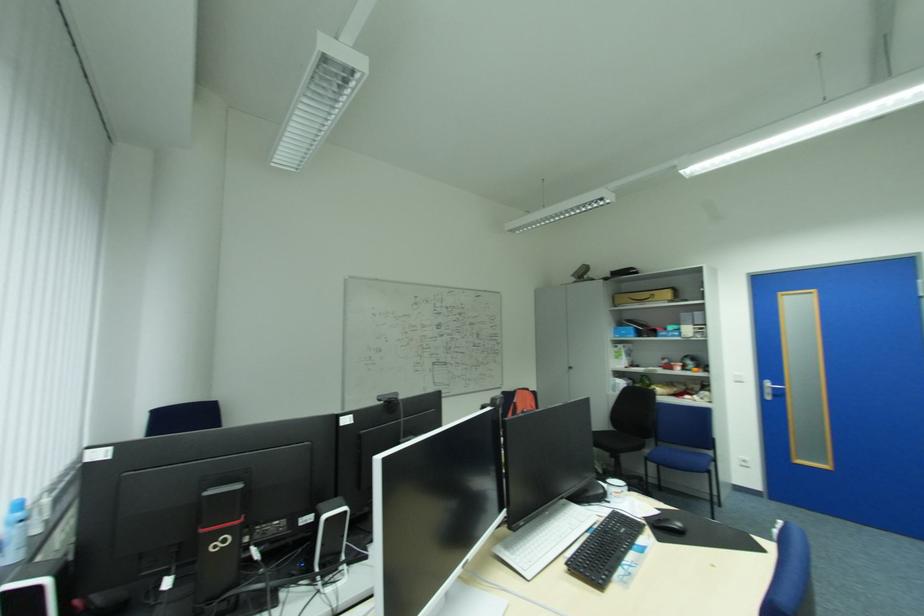
Which object does [543,537] point to?

This point indicates the white keyboard.